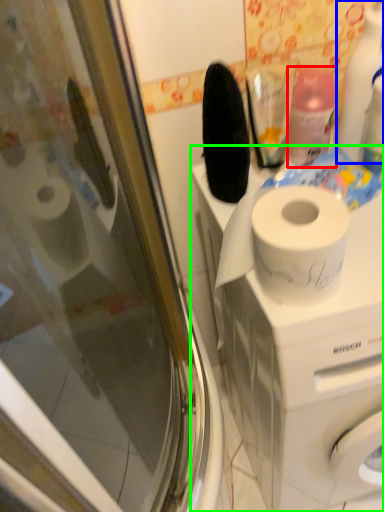
Question: Estimate the real-world distances between objects in this image. Which object is farther from cleaning product (highlighted by a red box), cleaning product (highlighted by a blue box) or washing machine (highlighted by a green box)?

Choices:
 (A) cleaning product
 (B) washing machine

Answer: (B)